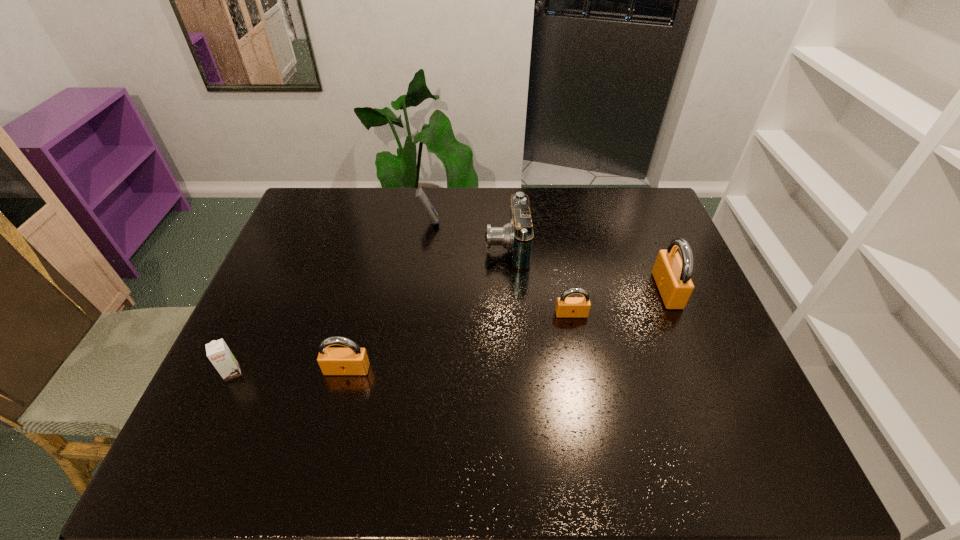
Where is `vacant space located 0.300m to unlock the second object from right to left from the front`? vacant space located 0.300m to unlock the second object from right to left from the front is located at coordinates (592, 422).

This screenshot has width=960, height=540. What are the coordinates of `vacant area situated to unlock the tallest padlock from the front` in the screenshot? It's located at pyautogui.click(x=585, y=290).

Where is `free space located to unlock the tallest padlock from the front`? free space located to unlock the tallest padlock from the front is located at coordinates (522, 290).

This screenshot has height=540, width=960. In order to click on vacant space located 0.330m to unlock the tallest padlock from the front in this screenshot , I will do `click(543, 290)`.

Identify the location of free point located 0.220m on the front-facing side of the calculator. (504, 221).

This screenshot has width=960, height=540. Find the location of `vacant space positioned on the front-facing side of the camcorder`. vacant space positioned on the front-facing side of the camcorder is located at coordinates (397, 246).

This screenshot has height=540, width=960. Identify the location of blank space located 0.120m on the front-facing side of the camcorder. (447, 246).

The image size is (960, 540). In order to click on free location located 0.390m on the front-facing side of the camcorder in this screenshot , I will do `click(363, 246)`.

Find the location of a particular element. The image size is (960, 540). free region located on the right of the leftmost object is located at coordinates (292, 373).

The width and height of the screenshot is (960, 540). Find the location of `calculator located at the far edge`. calculator located at the far edge is located at coordinates (420, 195).